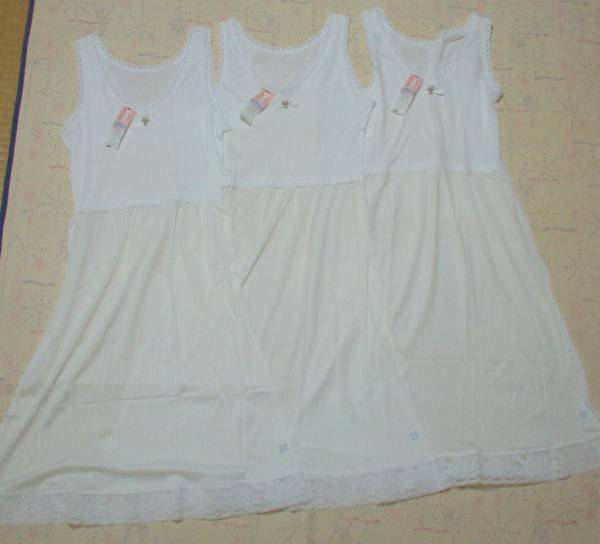
Image resolution: width=600 pixels, height=544 pixels. I want to click on lace, so click(x=158, y=515).